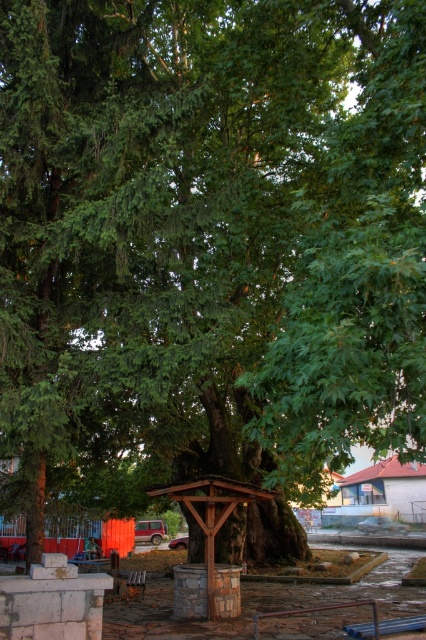
What do you see at coordinates (91, 561) in the screenshot?
I see `wooden picnic table at center` at bounding box center [91, 561].

Is wooden picnic table at center taller than brown wooden park bench at center?

Yes.

Who is more forward, (94, 552) or (135, 577)?

Point (135, 577) is more forward.

I want to click on wooden picnic table at center, so click(91, 561).